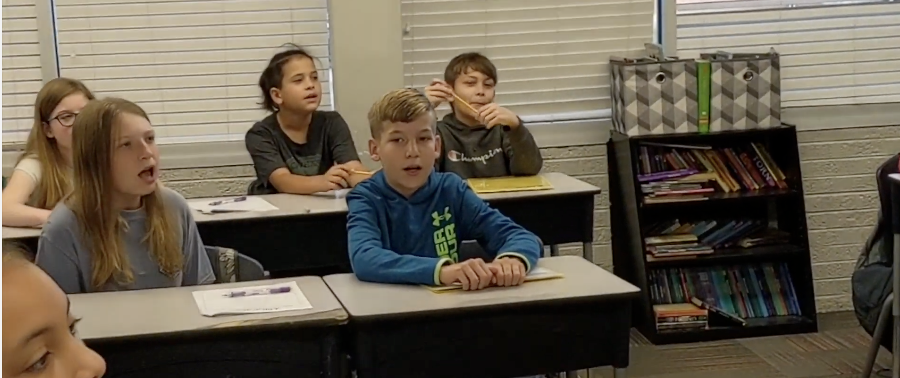
You are a GUI agent. You are given a task and a screenshot of the screen. Output one action in this format:
    pyautogui.click(x=<x>, y=<y>)
    Task: Click on the marker
    The height and width of the screenshot is (378, 900).
    Given the screenshot: What is the action you would take?
    pyautogui.click(x=282, y=287), pyautogui.click(x=240, y=195)